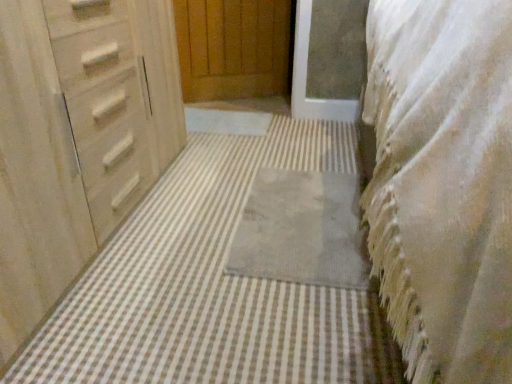
This screenshot has width=512, height=384. Describe the element at coordinates (301, 230) in the screenshot. I see `gray soft rug at center, the second bath mat when ordered from front to back` at that location.

Identify the location of matte wood chest of drawers at left. The image size is (512, 384). (77, 139).

Is gray soft rug at center, the second bath mat when ordered from front to back, wider than gray soft rug at center, the 2th bath mat when ordered from back to front?

No, gray soft rug at center, the second bath mat when ordered from front to back, is not wider than gray soft rug at center, the 2th bath mat when ordered from back to front.

Based on the photo, is gray soft rug at center, positioned as the 1th bath mat in back-to-front order, positioned with its back to gray soft rug at center, which is the 1th bath mat in front-to-back order?

Yes, gray soft rug at center, which is the 1th bath mat in front-to-back order, is at the back of gray soft rug at center, positioned as the 1th bath mat in back-to-front order.

From the image's perspective, who appears lower, gray soft rug at center, the second bath mat when ordered from front to back, or gray soft rug at center, which is the 1th bath mat in front-to-back order?

gray soft rug at center, the second bath mat when ordered from front to back, is shown below in the image.

Considering the points (269, 183) and (138, 246), which point is in front, point (269, 183) or point (138, 246)?

Positioned in front is point (138, 246).

Is point (330, 254) behind point (28, 325)?

Yes.

In the scene shown: Is gray soft rug at center, the second bath mat when ordered from front to back, positioned beyond the bounds of matte wood chest of drawers at left?

Absolutely, gray soft rug at center, the second bath mat when ordered from front to back, is external to matte wood chest of drawers at left.

Can you see gray soft rug at center, positioned as the 1th bath mat in back-to-front order, touching matte wood chest of drawers at left?

gray soft rug at center, positioned as the 1th bath mat in back-to-front order, is not next to matte wood chest of drawers at left, and they're not touching.

Is gray soft rug at center, the second bath mat when ordered from front to back, facing away from matte wood chest of drawers at left?

No, matte wood chest of drawers at left is not at the back of gray soft rug at center, the second bath mat when ordered from front to back.

Can you see white textured blanket at right touching matte wood chest of drawers at left?

No, white textured blanket at right is not making contact with matte wood chest of drawers at left.

In the scene shown: Can you confirm if white textured blanket at right is taller than matte wood chest of drawers at left?

Yes.

Is white textured blanket at right to the left or to the right of matte wood chest of drawers at left in the image?

white textured blanket at right is to the right of matte wood chest of drawers at left.

From a real-world perspective, is white textured blanket at right beneath matte wood chest of drawers at left?

Incorrect, from a real-world perspective, white textured blanket at right is higher than matte wood chest of drawers at left.

Is gray soft rug at center, which is the 1th bath mat in front-to-back order, in front of or behind matte wood chest of drawers at left in the image?

In the image, gray soft rug at center, which is the 1th bath mat in front-to-back order, appears behind matte wood chest of drawers at left.

From a real-world perspective, which object stands above the other?

matte wood chest of drawers at left.

Is gray soft rug at center, the 2th bath mat when ordered from back to front, thinner than matte wood chest of drawers at left?

No, gray soft rug at center, the 2th bath mat when ordered from back to front, is not thinner than matte wood chest of drawers at left.

In the scene shown: From a real-world perspective, is gray soft rug at center, which is the 1th bath mat in front-to-back order, on gray soft rug at center, positioned as the 1th bath mat in back-to-front order?

No, from a real-world perspective, gray soft rug at center, which is the 1th bath mat in front-to-back order, is not over gray soft rug at center, positioned as the 1th bath mat in back-to-front order

The width and height of the screenshot is (512, 384). What are the coordinates of `bath mat above the gray soft rug at center, positioned as the 1th bath mat in back-to-front order (from the image's perspective)` in the screenshot? It's located at (212, 286).

Is point (152, 364) in front of point (261, 223)?

Yes.

Does gray soft rug at center, which is the 1th bath mat in front-to-back order, have a greater height compared to gray soft rug at center, positioned as the 1th bath mat in back-to-front order?

Indeed, gray soft rug at center, which is the 1th bath mat in front-to-back order, has a greater height compared to gray soft rug at center, positioned as the 1th bath mat in back-to-front order.

What are the coordinates of `chest of drawers below the white textured blanket at right (from a real-world perspective)` in the screenshot? It's located at (77, 139).

Can you confirm if matte wood chest of drawers at left is positioned to the left of white textured blanket at right?

Yes.

Would you say matte wood chest of drawers at left is a long distance from white textured blanket at right?

Actually, matte wood chest of drawers at left and white textured blanket at right are a little close together.

Is matte wood chest of drawers at left taller or shorter than white textured blanket at right?

matte wood chest of drawers at left is shorter than white textured blanket at right.

Is gray soft rug at center, positioned as the 1th bath mat in back-to-front order, wider or thinner than white textured blanket at right?

Clearly, gray soft rug at center, positioned as the 1th bath mat in back-to-front order, has less width compared to white textured blanket at right.

Does gray soft rug at center, positioned as the 1th bath mat in back-to-front order, have a smaller size compared to white textured blanket at right?

Yes.

Consider the image. Between gray soft rug at center, positioned as the 1th bath mat in back-to-front order, and white textured blanket at right, which one has less height?

gray soft rug at center, positioned as the 1th bath mat in back-to-front order, is shorter.

Locate an element on the screen. This screenshot has width=512, height=384. bath mat below the gray soft rug at center, the second bath mat when ordered from front to back (from a real-world perspective) is located at coordinates (212, 286).

Find the location of a particular element. This screenshot has height=384, width=512. the 2nd bath mat below when counting from the matte wood chest of drawers at left (from the image's perspective) is located at coordinates click(x=301, y=230).

Estimate the real-world distances between objects in this image. Which object is closer to gray soft rug at center, the 2th bath mat when ordered from back to front, matte wood chest of drawers at left or gray soft rug at center, the second bath mat when ordered from front to back?

Based on the image, gray soft rug at center, the second bath mat when ordered from front to back, appears to be nearer to gray soft rug at center, the 2th bath mat when ordered from back to front.

When comparing their distances from gray soft rug at center, which is the 1th bath mat in front-to-back order, does white textured blanket at right or matte wood chest of drawers at left seem further?

white textured blanket at right.

Looking at this image, based on their spatial positions, is gray soft rug at center, which is the 1th bath mat in front-to-back order, or gray soft rug at center, positioned as the 1th bath mat in back-to-front order, further from white textured blanket at right?

gray soft rug at center, positioned as the 1th bath mat in back-to-front order.

Considering their positions, is white textured blanket at right positioned further to gray soft rug at center, the second bath mat when ordered from front to back, than gray soft rug at center, the 2th bath mat when ordered from back to front?

white textured blanket at right.

From the image, which object appears to be nearer to matte wood chest of drawers at left, white textured blanket at right or gray soft rug at center, the second bath mat when ordered from front to back?

gray soft rug at center, the second bath mat when ordered from front to back, is closer to matte wood chest of drawers at left.

Based on the photo, from the image, which object appears to be farther from gray soft rug at center, the 2th bath mat when ordered from back to front, matte wood chest of drawers at left or white textured blanket at right?

The object further to gray soft rug at center, the 2th bath mat when ordered from back to front, is white textured blanket at right.

From the image, which object appears to be farther from matte wood chest of drawers at left, gray soft rug at center, the second bath mat when ordered from front to back, or gray soft rug at center, which is the 1th bath mat in front-to-back order?

Among the two, gray soft rug at center, the second bath mat when ordered from front to back, is located further to matte wood chest of drawers at left.

When comparing their distances from white textured blanket at right, does gray soft rug at center, the second bath mat when ordered from front to back, or matte wood chest of drawers at left seem closer?

gray soft rug at center, the second bath mat when ordered from front to back, lies closer to white textured blanket at right than the other object.

Where is `bath mat positioned between white textured blanket at right and gray soft rug at center, the second bath mat when ordered from front to back, from near to far`? This screenshot has width=512, height=384. bath mat positioned between white textured blanket at right and gray soft rug at center, the second bath mat when ordered from front to back, from near to far is located at coordinates (212, 286).

Identify the location of bath mat between matte wood chest of drawers at left and gray soft rug at center, the second bath mat when ordered from front to back. Image resolution: width=512 pixels, height=384 pixels. (212, 286).